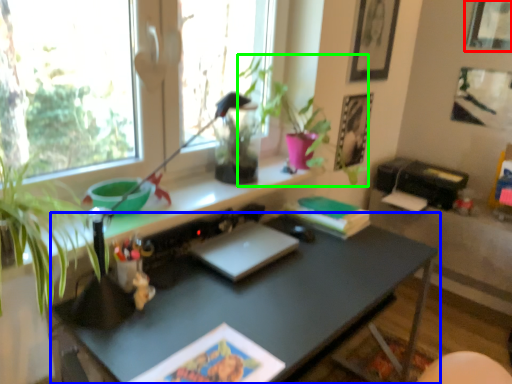
Question: Estimate the real-world distances between objects in this image. Which object is closer to picture frame (highlighted by a red box), desk (highlighted by a blue box) or plant (highlighted by a green box)?

Choices:
 (A) desk
 (B) plant

Answer: (B)